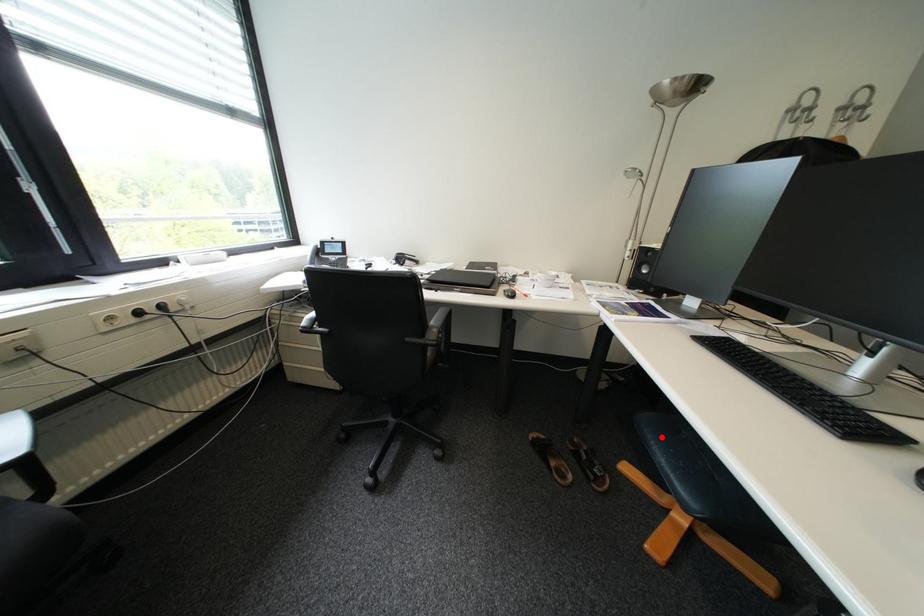
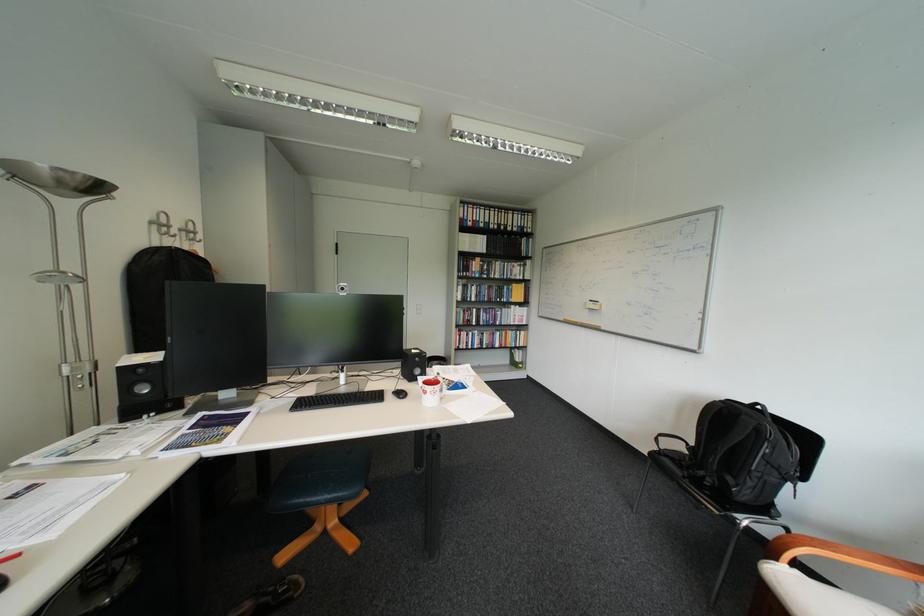
Question: I am providing you with two images of the same scene from different viewpoints. A red point is marked on the first image. Is the red point's position out of view in image 2?

Choices:
 (A) Yes
 (B) No

Answer: (B)